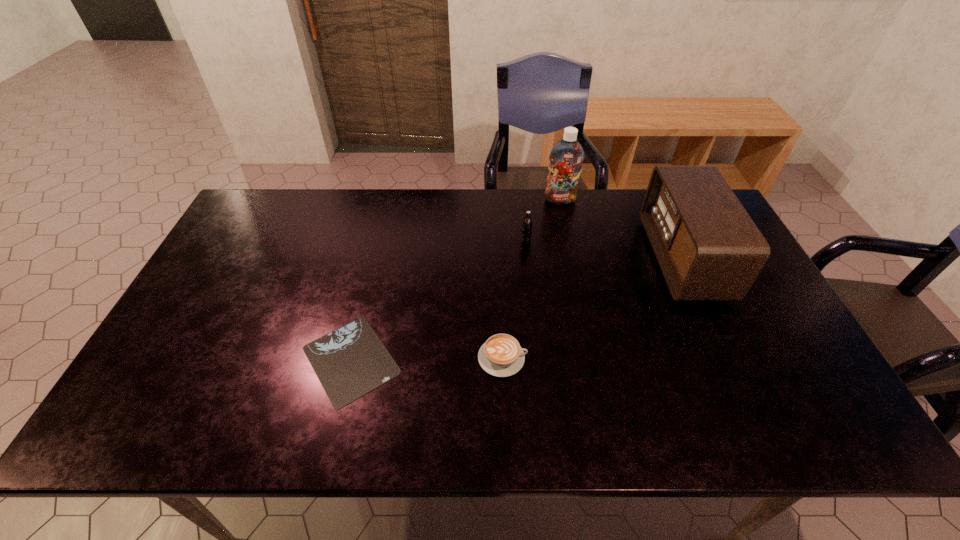
Where is `vacant area that lies between the fourth shortest object and the second object from right to left`? vacant area that lies between the fourth shortest object and the second object from right to left is located at coordinates (621, 229).

Where is `vacant region between the pop and the rightmost object`? vacant region between the pop and the rightmost object is located at coordinates (604, 249).

The image size is (960, 540). Find the location of `free space between the tallest object and the leftmost object`. free space between the tallest object and the leftmost object is located at coordinates [x=456, y=280].

Identify the location of free space that is in between the third object from left to right and the cappuccino. (515, 299).

Identify the location of free point between the mousepad and the fourth tallest object. (426, 359).

Find the location of a particular element. vacant point located between the second object from right to left and the mousepad is located at coordinates (456, 280).

Locate which object is the third closest to the leftmost object. Please provide its 2D coordinates. Your answer should be formatted as a tuple, i.e. [(x, y)], where the tuple contains the x and y coordinates of a point satisfying the conditions above.

[(566, 157)]

At what (x,y) coordinates should I click in order to perform the action: click on the third closest object to the pop. Please return your answer as a coordinate pair (x, y). Looking at the image, I should click on 501,355.

The width and height of the screenshot is (960, 540). I want to click on vacant space that satisfies the following two spatial constraints: 1. on the front label of the pop; 2. on the side of the second object from left to right with the handle, so click(539, 358).